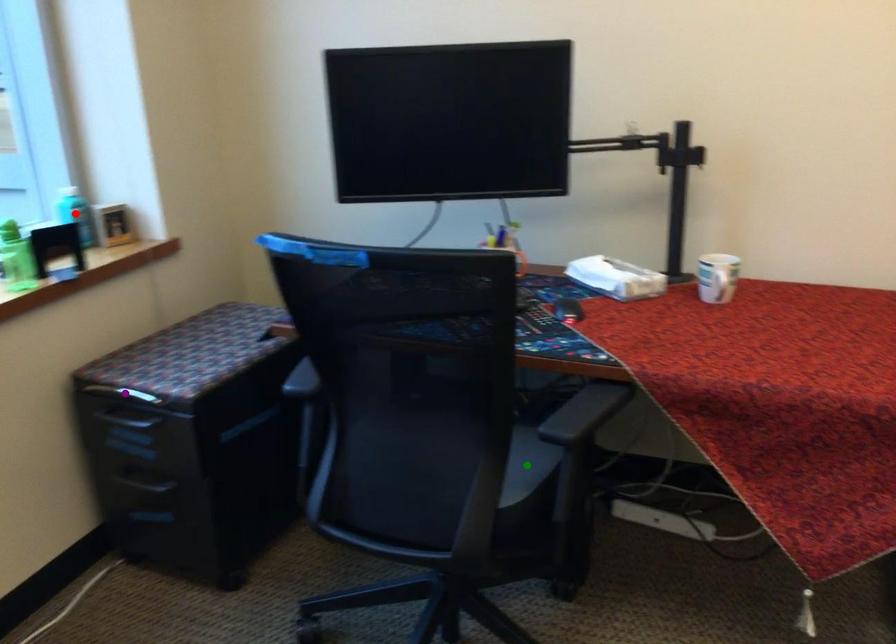
Order these from farthest to nearest:
green point | red point | purple point

red point → purple point → green point